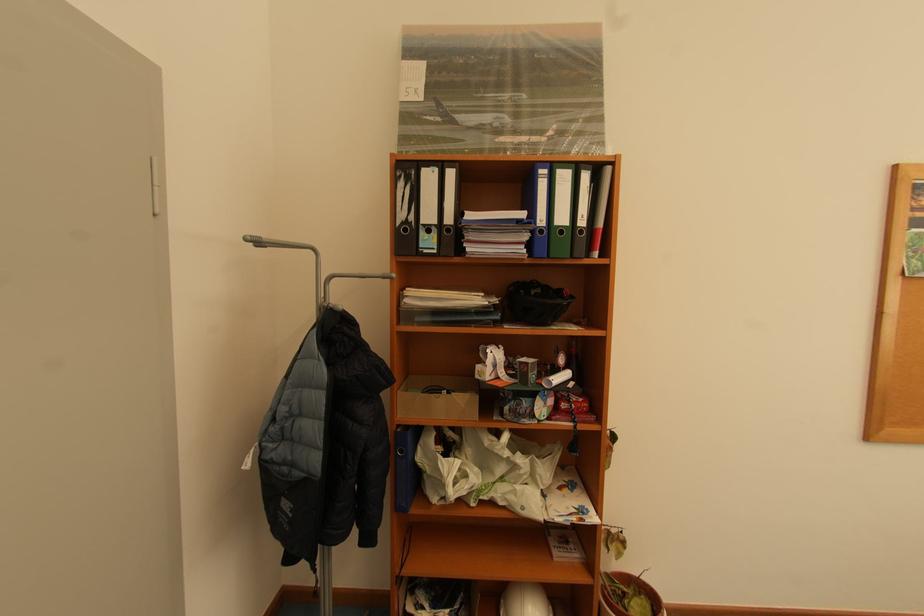
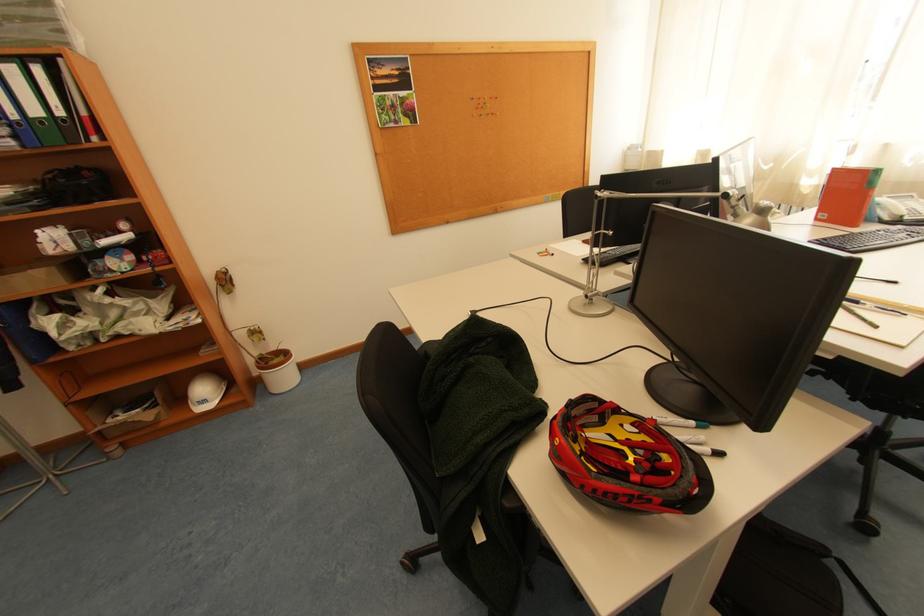
Locate, in the second image, the point that corresponds to the point at 614,576 in the first image.

(270, 355)